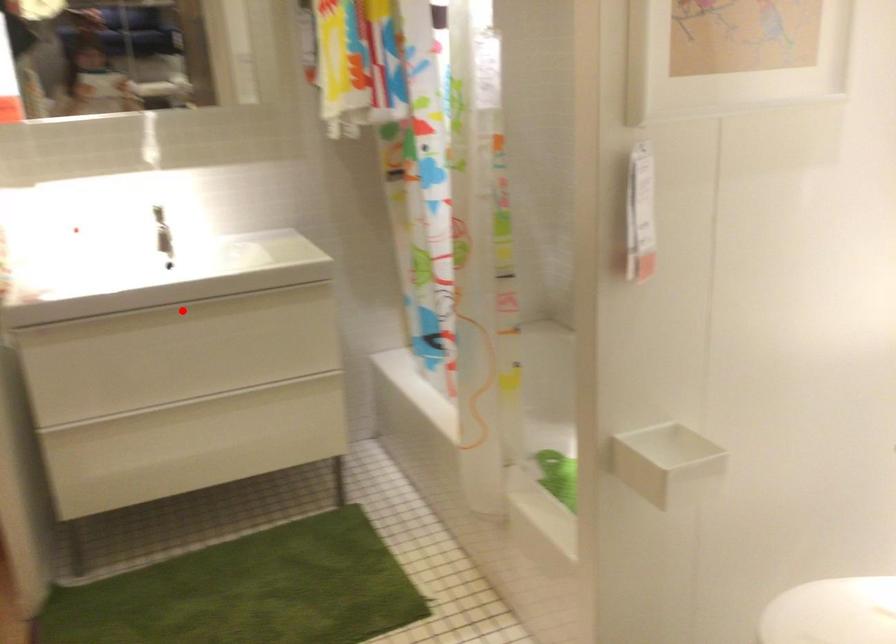
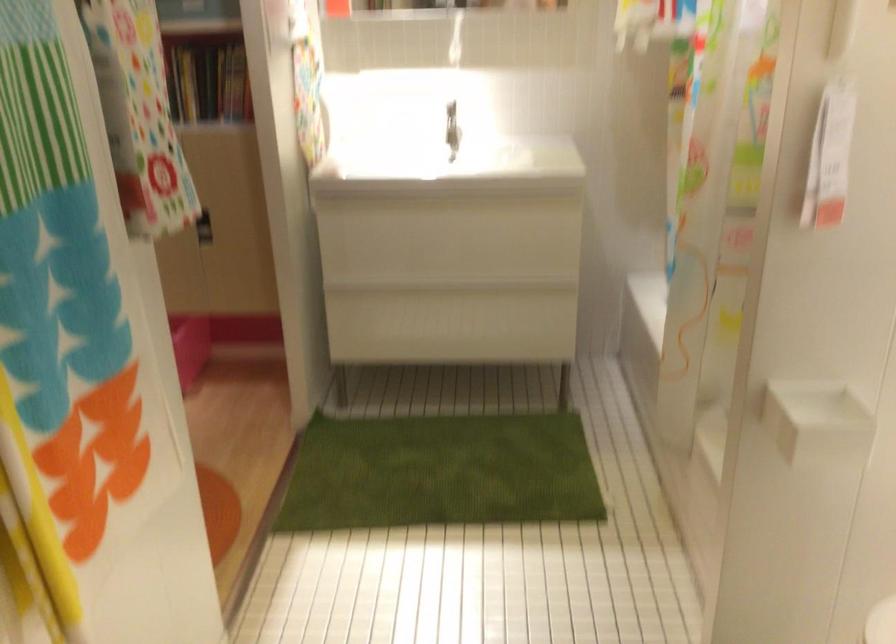
Question: I am providing you with two images of the same scene from different viewpoints. Given a red point in image1, look at the same physical point in image2. Is it:

Choices:
 (A) Closer to the viewpoint
 (B) Farther from the viewpoint

Answer: (B)